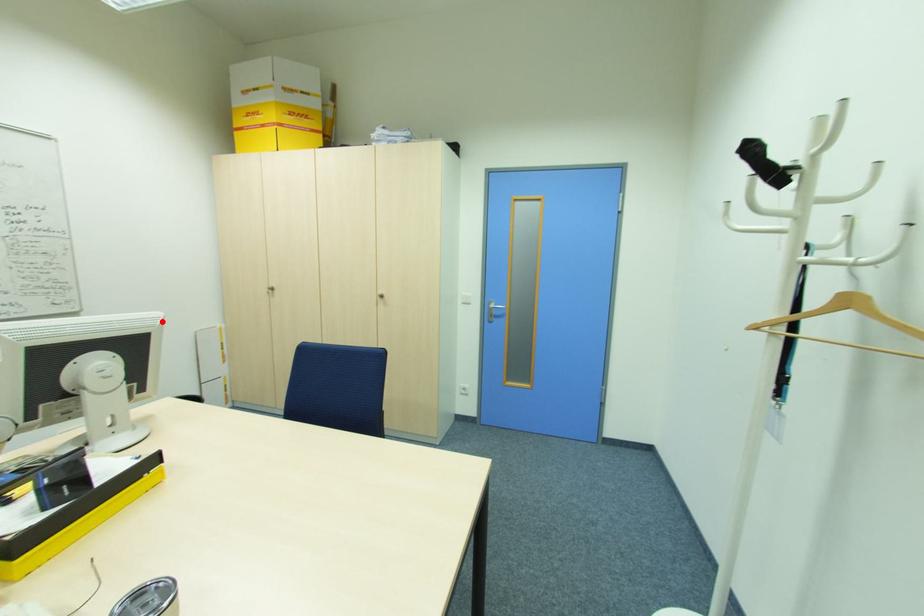
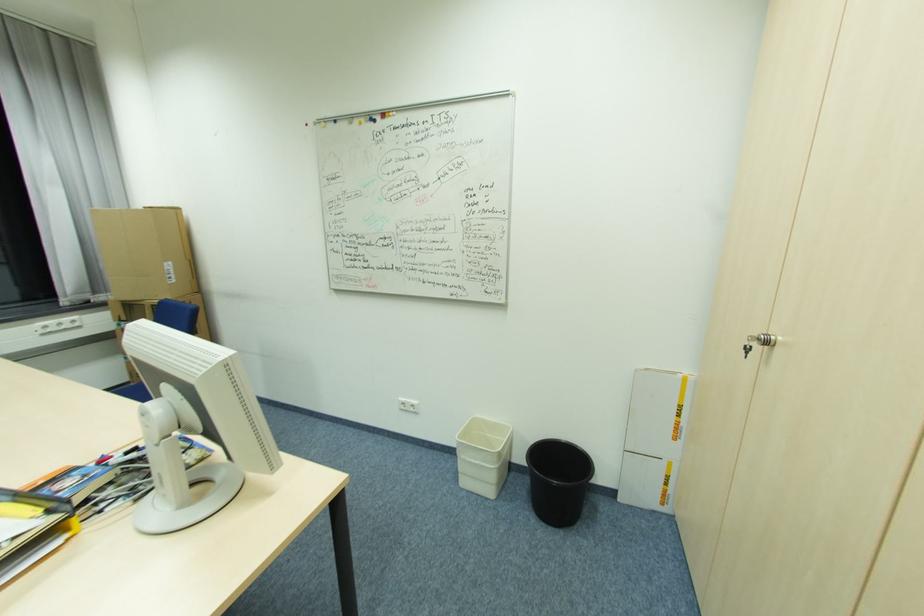
In the second image, find the point that corresponds to the highlighted location in the first image.

(207, 371)